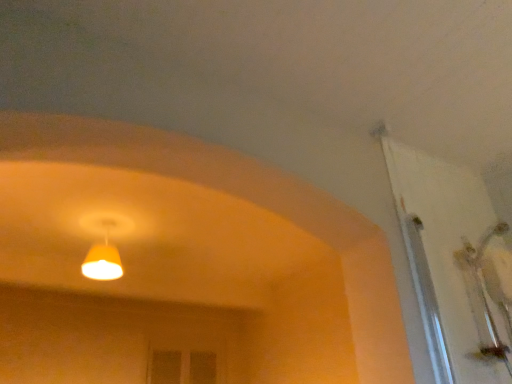
Question: Is yellow matte lampshade at upper center bigger or smaller than white glossy door at upper right?

Choices:
 (A) big
 (B) small

Answer: (B)

Question: Is yellow matte lampshade at upper center taller or shorter than white glossy door at upper right?

Choices:
 (A) short
 (B) tall

Answer: (A)

Question: Is yellow matte lampshade at upper center wider or thinner than white glossy door at upper right?

Choices:
 (A) thin
 (B) wide

Answer: (A)

Question: Which is correct: white glossy door at upper right is inside yellow matte lampshade at upper center, or outside of it?

Choices:
 (A) outside
 (B) inside

Answer: (A)

Question: Visually, is white glossy door at upper right positioned to the left or to the right of yellow matte lampshade at upper center?

Choices:
 (A) right
 (B) left

Answer: (A)

Question: Does point (467, 203) appear closer or farther from the camera than point (80, 269)?

Choices:
 (A) closer
 (B) farther

Answer: (A)

Question: Looking at their shapes, would you say white glossy door at upper right is wider or thinner than yellow matte lampshade at upper center?

Choices:
 (A) thin
 (B) wide

Answer: (B)